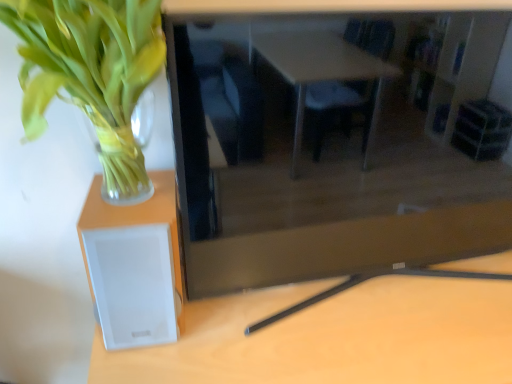
This screenshot has width=512, height=384. I want to click on green leafy plant at left, so click(92, 74).

Locate an element on the screen. Image resolution: width=512 pixels, height=384 pixels. white matte speaker at left is located at coordinates (133, 284).

Where is `green leafy plant at left`? The image size is (512, 384). green leafy plant at left is located at coordinates (92, 74).

From the picture: Between matte black tv at center and white plastic speaker at lower left, which one is positioned in front?

matte black tv at center is closer to the camera.

Which point is more forward, (313, 32) or (405, 277)?

Positioned in front is point (313, 32).

Is matte black tv at center spatially inside white plastic speaker at lower left, or outside of it?

matte black tv at center cannot be found inside white plastic speaker at lower left.

How many degrees apart are the facing directions of white matte speaker at left and white plastic speaker at lower left?

0.429 degrees separate the facing orientations of white matte speaker at left and white plastic speaker at lower left.

In the scene shown: Is white matte speaker at left positioned before white plastic speaker at lower left?

No, white matte speaker at left is further to the viewer.

Considering the relative positions of white matte speaker at left and white plastic speaker at lower left in the image provided, is white matte speaker at left to the left or to the right of white plastic speaker at lower left?

Based on their positions, white matte speaker at left is located to the left of white plastic speaker at lower left.

From the picture: Is white matte speaker at left oriented away from white plastic speaker at lower left?

No, white matte speaker at left's orientation is not away from white plastic speaker at lower left.

Are white matte speaker at left and green leafy plant at left located far from each other?

No, white matte speaker at left is in close proximity to green leafy plant at left.

Is white matte speaker at left spatially inside green leafy plant at left, or outside of it?

white matte speaker at left is not inside green leafy plant at left, it's outside.

Which of these two, white matte speaker at left or green leafy plant at left, is thinner?

white matte speaker at left is thinner.

Can you tell me how much green leafy plant at left and matte black tv at center differ in facing direction?

2.3 degrees.

From the image's perspective, is green leafy plant at left below matte black tv at center?

No, from the image's perspective, green leafy plant at left is not below matte black tv at center.

Who is more distant, green leafy plant at left or matte black tv at center?

matte black tv at center is further from the camera.

Is green leafy plant at left taller than matte black tv at center?

No, green leafy plant at left is not taller than matte black tv at center.

Looking at this image, is matte black tv at center completely or partially inside white matte speaker at left?

No, matte black tv at center is not a part of white matte speaker at left.

From the image's perspective, which is above, white matte speaker at left or matte black tv at center?

From the image's view, matte black tv at center is above.

Which is more to the right, white matte speaker at left or matte black tv at center?

matte black tv at center is more to the right.

Is matte black tv at center wider or thinner than green leafy plant at left?

matte black tv at center is thinner than green leafy plant at left.

In the image, there is a matte black tv at center. Where is `houseplant above it (from the image's perspective)`? houseplant above it (from the image's perspective) is located at coordinates (92, 74).

Can green leafy plant at left be found inside matte black tv at center?

Definitely not — green leafy plant at left is not inside matte black tv at center.

How much distance is there between matte black tv at center and green leafy plant at left?

A distance of 11.11 inches exists between matte black tv at center and green leafy plant at left.

Is white plastic speaker at lower left touching matte black tv at center?

white plastic speaker at lower left and matte black tv at center are clearly separated.

From a real-world perspective, who is located higher, white plastic speaker at lower left or matte black tv at center?

matte black tv at center.

Can you confirm if white plastic speaker at lower left is positioned to the right of matte black tv at center?

Yes, white plastic speaker at lower left is to the right of matte black tv at center.

Locate an element on the screen. The width and height of the screenshot is (512, 384). computer desk located above the white plastic speaker at lower left (from a real-world perspective) is located at coordinates (334, 138).

You are a GUI agent. You are given a task and a screenshot of the screen. Output one action in this format:
    pyautogui.click(x=<x>, y=<y>)
    Task: Click on the speaker above the white plastic speaker at lower left (from the image's perspective)
    The image size is (512, 384).
    Given the screenshot: What is the action you would take?
    pyautogui.click(x=133, y=284)

From the image, which object appears to be farther from white matte speaker at left, matte black tv at center or green leafy plant at left?

matte black tv at center is further to white matte speaker at left.

Looking at this image, estimate the real-world distances between objects in this image. Which object is further from matte black tv at center, green leafy plant at left or white plastic speaker at lower left?

Based on the image, green leafy plant at left appears to be further to matte black tv at center.

Looking at the image, which one is located closer to white matte speaker at left, white plastic speaker at lower left or green leafy plant at left?

The object closer to white matte speaker at left is green leafy plant at left.

Based on their spatial positions, is white plastic speaker at lower left or matte black tv at center closer to white matte speaker at left?

Among the two, white plastic speaker at lower left is located nearer to white matte speaker at left.

From the image, which object appears to be nearer to green leafy plant at left, white matte speaker at left or matte black tv at center?

white matte speaker at left lies closer to green leafy plant at left than the other object.

Estimate the real-world distances between objects in this image. Which object is closer to green leafy plant at left, white matte speaker at left or white plastic speaker at lower left?

white matte speaker at left is closer to green leafy plant at left.

Which object lies further to the anchor point white plastic speaker at lower left, white matte speaker at left or matte black tv at center?

Among the two, matte black tv at center is located further to white plastic speaker at lower left.

Which object lies nearer to the anchor point white matte speaker at left, green leafy plant at left or matte black tv at center?

The object closer to white matte speaker at left is green leafy plant at left.

At what (x,y) coordinates should I click in order to perform the action: click on speaker between green leafy plant at left and matte black tv at center. Please return your answer as a coordinate pair (x, y). Looking at the image, I should click on (133, 284).

Where is `computer desk between green leafy plant at left and white plastic speaker at lower left in the vertical direction`? The height and width of the screenshot is (384, 512). computer desk between green leafy plant at left and white plastic speaker at lower left in the vertical direction is located at coordinates (334, 138).

In order to click on speaker between green leafy plant at left and white plastic speaker at lower left from left to right in this screenshot , I will do `click(133, 284)`.

Identify the location of computer desk located between white matte speaker at left and white plastic speaker at lower left in the left-right direction. The height and width of the screenshot is (384, 512). (334, 138).